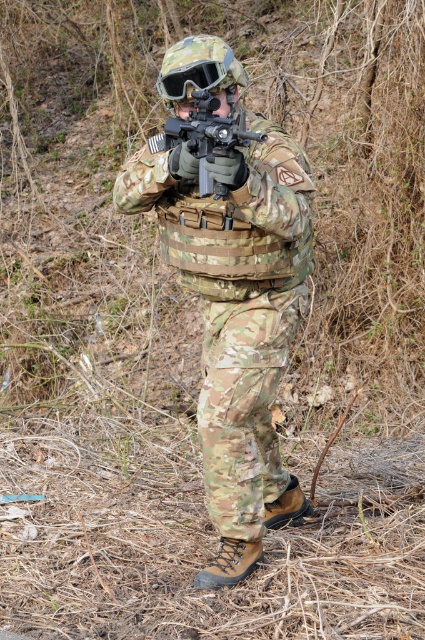
Question: Is camo uniform at center to the left of matte green plastic goggles at upper center from the viewer's perspective?

Choices:
 (A) no
 (B) yes

Answer: (A)

Question: Which object is positioned closest to the matte black rifle at center?

Choices:
 (A) camo uniform at center
 (B) matte green plastic goggles at upper center

Answer: (B)

Question: From the image, what is the correct spatial relationship of camo uniform at center in relation to matte black rifle at center?

Choices:
 (A) above
 (B) below

Answer: (B)

Question: Among these points, which one is nearest to the camera?

Choices:
 (A) (175, 88)
 (B) (198, 163)

Answer: (B)

Question: Among these points, which one is farthest from the camera?

Choices:
 (A) (229, 52)
 (B) (152, 152)
 (C) (249, 308)

Answer: (C)

Question: Does camo uniform at center appear under matte green plastic goggles at upper center?

Choices:
 (A) yes
 (B) no

Answer: (A)